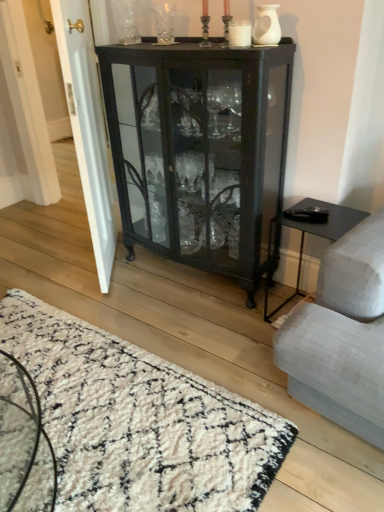
The height and width of the screenshot is (512, 384). What are the coordinates of `empty space that is ontop of white shaggy rug at lower left (from a real-world perspective)` in the screenshot? It's located at (89, 397).